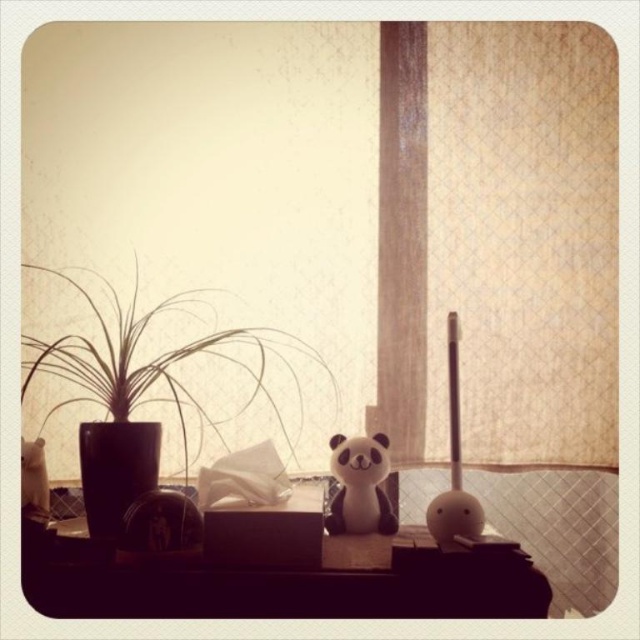
You are organizing items on a desk and need to place a new item at coordinates 0.5, 0.25. Is there enough space next to the green matte plant at left to place it there?

The green matte plant at left is located at point (156, 364). Since the new item is to be placed at (160, 320), which is close but not exactly overlapping, there might be enough space depending on the size of the plant and the new item. However, without knowing the dimensions of both, it is difficult to determine definitively.

You are standing in the room and want to reach the white textured curtain at center to adjust its position. Considering your arm length is 2.5 feet, can you reach it without moving closer?

The white textured curtain at center is 4.85 feet away from you, which is farther than your 2.5 feet arm length. Therefore, you cannot reach it without moving closer.